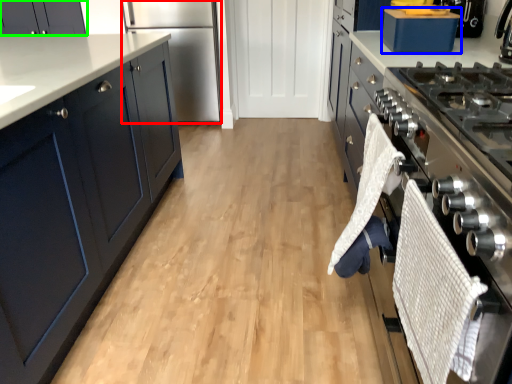
Question: Which is nearer to the refrigerator (highlighted by a red box)? kitchen appliance (highlighted by a blue box) or cabinetry (highlighted by a green box).

Choices:
 (A) kitchen appliance
 (B) cabinetry

Answer: (B)